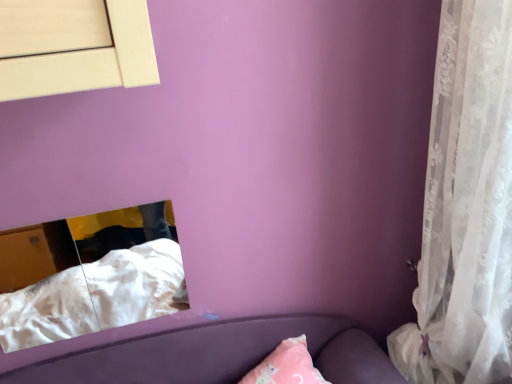
Question: Considering the positions of white soft fabric at lower left and white lace curtain at right in the image, is white soft fabric at lower left taller or shorter than white lace curtain at right?

Choices:
 (A) short
 (B) tall

Answer: (A)

Question: Considering their positions, is white soft fabric at lower left located in front of or behind white lace curtain at right?

Choices:
 (A) behind
 (B) front

Answer: (A)

Question: Considering the positions of white soft fabric at lower left and white lace curtain at right in the image, is white soft fabric at lower left bigger or smaller than white lace curtain at right?

Choices:
 (A) small
 (B) big

Answer: (A)

Question: Is white lace curtain at right taller or shorter than white soft fabric at lower left?

Choices:
 (A) short
 (B) tall

Answer: (B)

Question: Is point (481, 49) closer or farther from the camera than point (178, 269)?

Choices:
 (A) closer
 (B) farther

Answer: (A)

Question: In the image, is white lace curtain at right on the left side or the right side of white soft fabric at lower left?

Choices:
 (A) left
 (B) right

Answer: (B)

Question: Which is correct: white lace curtain at right is inside white soft fabric at lower left, or outside of it?

Choices:
 (A) outside
 (B) inside

Answer: (A)